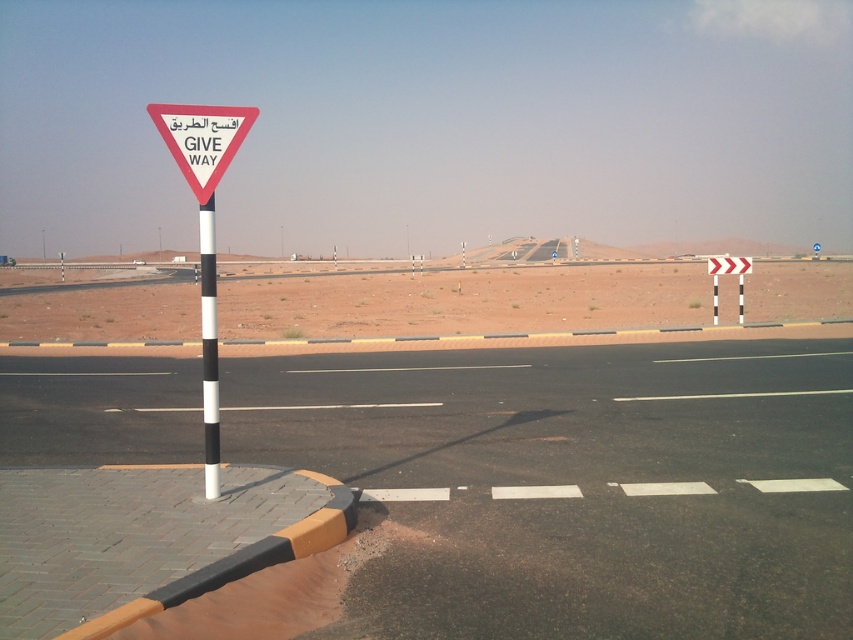
You are a hiker trying to cross the desert road. You see the desert sand at center and the black and white striped pole at left. Which object is higher in elevation?

The desert sand at center is much taller than the black and white striped pole at left, so the desert sand at center has higher elevation.

You are standing at the center of the image and want to reach the black asphalt highway at left. Which direction should you walk to get there?

You should walk to the left to reach the black asphalt highway at left.